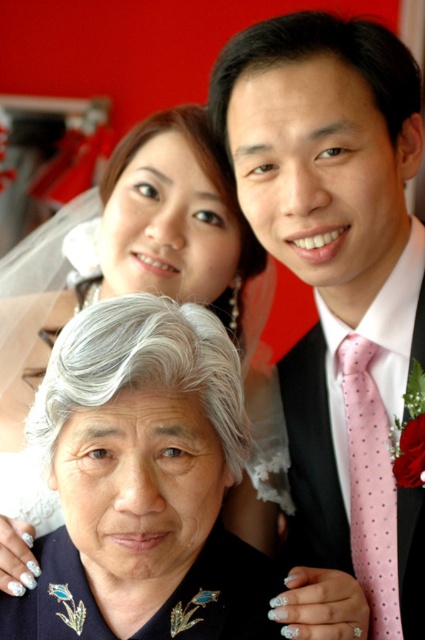
Looking at this image, you are a photographer adjusting the camera focus. The elderly woman with floral embroidery and the man in the black suit are in the frame. Where is the pink dotted tie at center positioned relative to their bodies?

The pink dotted tie at center is located at point (337, 276) in the image coordinates, which places it centrally positioned between the elderly woman and the man in the black suit.